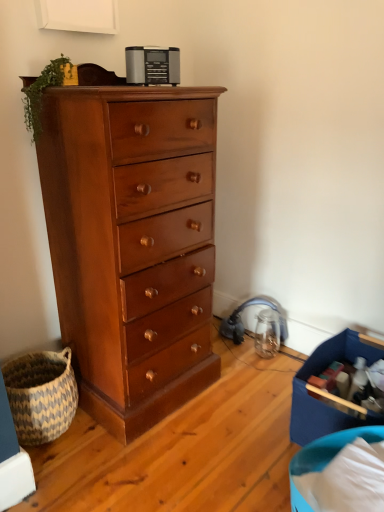
Question: Is the depth of blue fabric storage box at lower right greater than that of shiny brown wood chest of drawers at left?

Choices:
 (A) no
 (B) yes

Answer: (B)

Question: Is blue fabric storage box at lower right oriented towards shiny brown wood chest of drawers at left?

Choices:
 (A) yes
 (B) no

Answer: (B)

Question: Can we say blue fabric storage box at lower right lies outside shiny brown wood chest of drawers at left?

Choices:
 (A) no
 (B) yes

Answer: (B)

Question: Is blue fabric storage box at lower right positioned before shiny brown wood chest of drawers at left?

Choices:
 (A) no
 (B) yes

Answer: (A)

Question: From a real-world perspective, is blue fabric storage box at lower right beneath shiny brown wood chest of drawers at left?

Choices:
 (A) no
 (B) yes

Answer: (B)

Question: Is blue fabric storage box at lower right bigger than shiny brown wood chest of drawers at left?

Choices:
 (A) yes
 (B) no

Answer: (B)

Question: Is natural woven basket at lower left to the left of satin silver radio at upper center from the viewer's perspective?

Choices:
 (A) no
 (B) yes

Answer: (B)

Question: Is natural woven basket at lower left turned away from satin silver radio at upper center?

Choices:
 (A) yes
 (B) no

Answer: (B)

Question: Are natural woven basket at lower left and satin silver radio at upper center making contact?

Choices:
 (A) yes
 (B) no

Answer: (B)

Question: Is natural woven basket at lower left outside satin silver radio at upper center?

Choices:
 (A) yes
 (B) no

Answer: (A)

Question: From a real-world perspective, is natural woven basket at lower left over satin silver radio at upper center?

Choices:
 (A) yes
 (B) no

Answer: (B)

Question: Is natural woven basket at lower left to the right of satin silver radio at upper center from the viewer's perspective?

Choices:
 (A) yes
 (B) no

Answer: (B)

Question: Is blue fabric storage box at lower right outside natural woven basket at lower left?

Choices:
 (A) yes
 (B) no

Answer: (A)